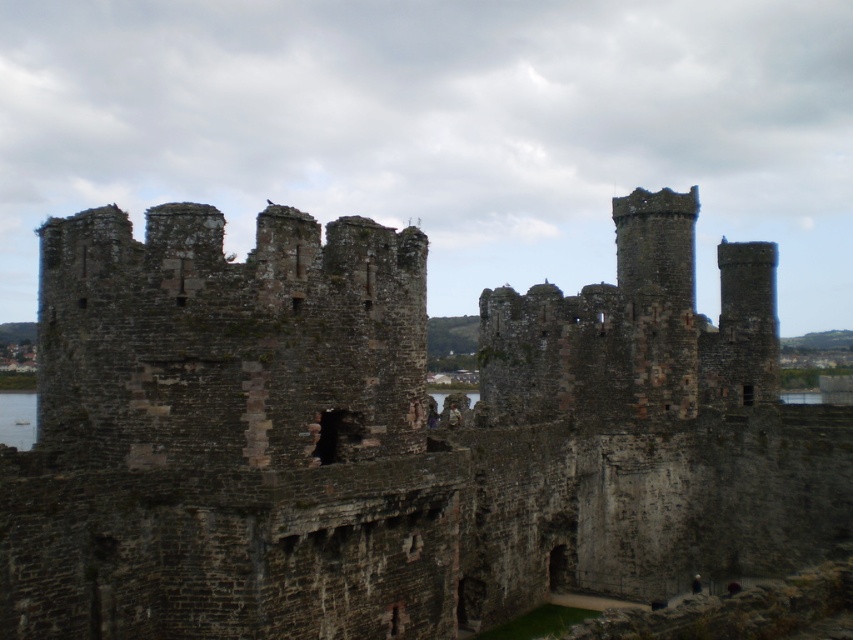
Is dark stone castle at center below camouflage fabric person at center?

Actually, dark stone castle at center is above camouflage fabric person at center.

From the picture: Does dark stone castle at center have a lesser width compared to camouflage fabric person at center?

No.

Does point (407, 433) come behind point (456, 417)?

That is False.

Find the location of `dark stone castle at center`. dark stone castle at center is located at coordinates (393, 435).

Can you confirm if dark stone castle at center is positioned to the right of clear water at lower left?

Correct, you'll find dark stone castle at center to the right of clear water at lower left.

Is dark stone castle at center to the left of clear water at lower left from the viewer's perspective?

No, dark stone castle at center is not to the left of clear water at lower left.

The image size is (853, 640). What do you see at coordinates (393, 435) in the screenshot?
I see `dark stone castle at center` at bounding box center [393, 435].

You are a GUI agent. You are given a task and a screenshot of the screen. Output one action in this format:
    pyautogui.click(x=<x>, y=<y>)
    Task: Click on the dark stone castle at center
    The width and height of the screenshot is (853, 640).
    Given the screenshot: What is the action you would take?
    pyautogui.click(x=393, y=435)

Can you confirm if clear water at lower left is positioned below camouflage fabric person at center?

Correct, clear water at lower left is located below camouflage fabric person at center.

Looking at this image, does clear water at lower left lie in front of camouflage fabric person at center?

No, it is not.

What do you see at coordinates (16, 419) in the screenshot?
I see `clear water at lower left` at bounding box center [16, 419].

Identify the location of clear water at lower left. (16, 419).